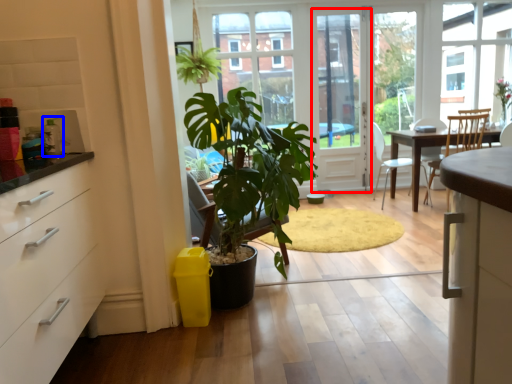
Question: Which object is further to the camera taking this photo, screen door (highlighted by a red box) or appliance (highlighted by a blue box)?

Choices:
 (A) screen door
 (B) appliance

Answer: (A)